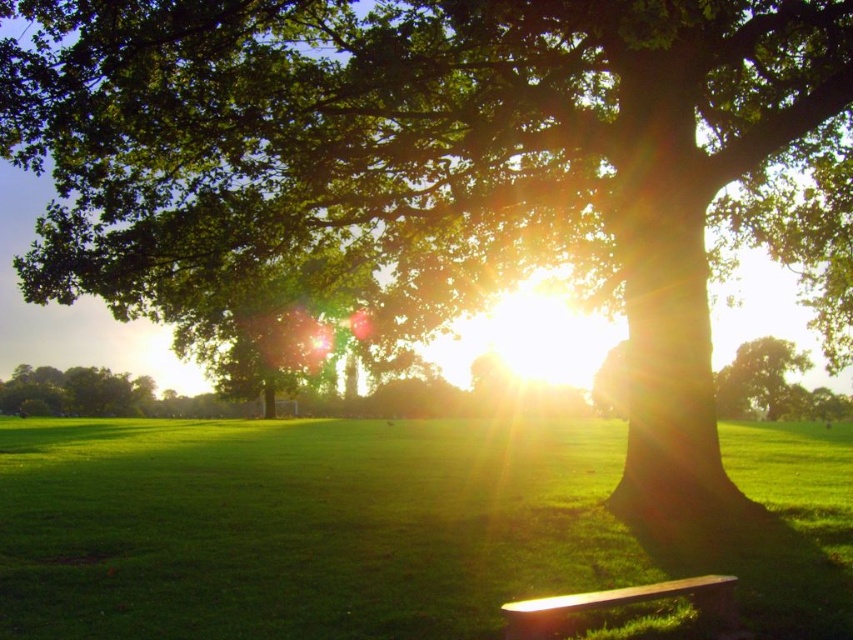
Question: Does green grassy at lower center come in front of green leafy tree at center?

Choices:
 (A) no
 (B) yes

Answer: (B)

Question: Which object appears farthest from the camera in this image?

Choices:
 (A) black matte bench at lower center
 (B) green leafy tree at center

Answer: (B)

Question: Estimate the real-world distances between objects in this image. Which object is farther from the green leafy tree at center?

Choices:
 (A) green grassy at lower center
 (B) black matte bench at lower center

Answer: (B)

Question: Which point is farther from the camera taking this photo?

Choices:
 (A) (114, 528)
 (B) (680, 592)
 (C) (763, 384)

Answer: (C)

Question: Does black matte bench at lower center appear on the right side of green leafy tree at center?

Choices:
 (A) yes
 (B) no

Answer: (B)

Question: Is green grassy at lower center below green leafy tree at center?

Choices:
 (A) yes
 (B) no

Answer: (A)